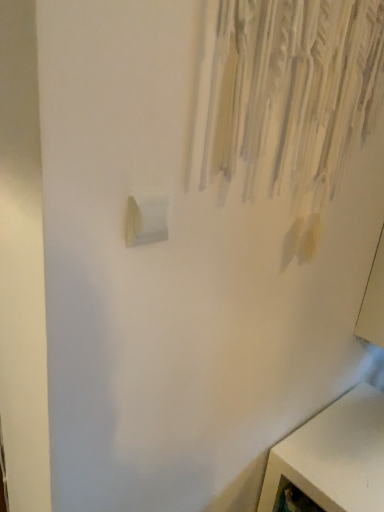
Question: From a real-world perspective, does white plastic light switch at lower left sit lower than white matte cabinet at lower right?

Choices:
 (A) no
 (B) yes

Answer: (A)

Question: Can you confirm if white plastic light switch at lower left is bigger than white matte cabinet at lower right?

Choices:
 (A) yes
 (B) no

Answer: (B)

Question: Does white plastic light switch at lower left have a greater width compared to white matte cabinet at lower right?

Choices:
 (A) no
 (B) yes

Answer: (A)

Question: Is white plastic light switch at lower left to the left of white matte cabinet at lower right from the viewer's perspective?

Choices:
 (A) no
 (B) yes

Answer: (B)

Question: Is white plastic light switch at lower left with white matte cabinet at lower right?

Choices:
 (A) yes
 (B) no

Answer: (B)

Question: Is white plastic light switch at lower left outside of white matte cabinet at lower right?

Choices:
 (A) no
 (B) yes

Answer: (B)

Question: Are white matte cabinet at lower right and white plastic light switch at lower left making contact?

Choices:
 (A) yes
 (B) no

Answer: (B)

Question: From the image's perspective, is white matte cabinet at lower right located beneath white plastic light switch at lower left?

Choices:
 (A) yes
 (B) no

Answer: (A)

Question: Considering the relative sizes of white matte cabinet at lower right and white plastic light switch at lower left in the image provided, is white matte cabinet at lower right smaller than white plastic light switch at lower left?

Choices:
 (A) no
 (B) yes

Answer: (A)

Question: Can you confirm if white matte cabinet at lower right is thinner than white plastic light switch at lower left?

Choices:
 (A) no
 (B) yes

Answer: (A)

Question: Is white matte cabinet at lower right oriented away from white plastic light switch at lower left?

Choices:
 (A) yes
 (B) no

Answer: (B)

Question: Can you confirm if white matte cabinet at lower right is positioned to the right of white plastic light switch at lower left?

Choices:
 (A) no
 (B) yes

Answer: (B)

Question: Is white matte cabinet at lower right bigger or smaller than white plastic light switch at lower left?

Choices:
 (A) big
 (B) small

Answer: (A)